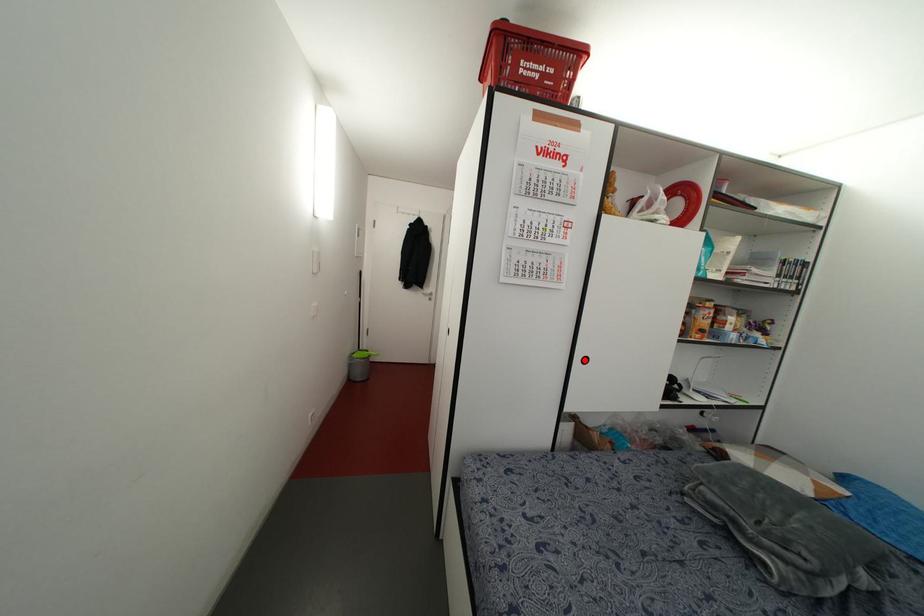
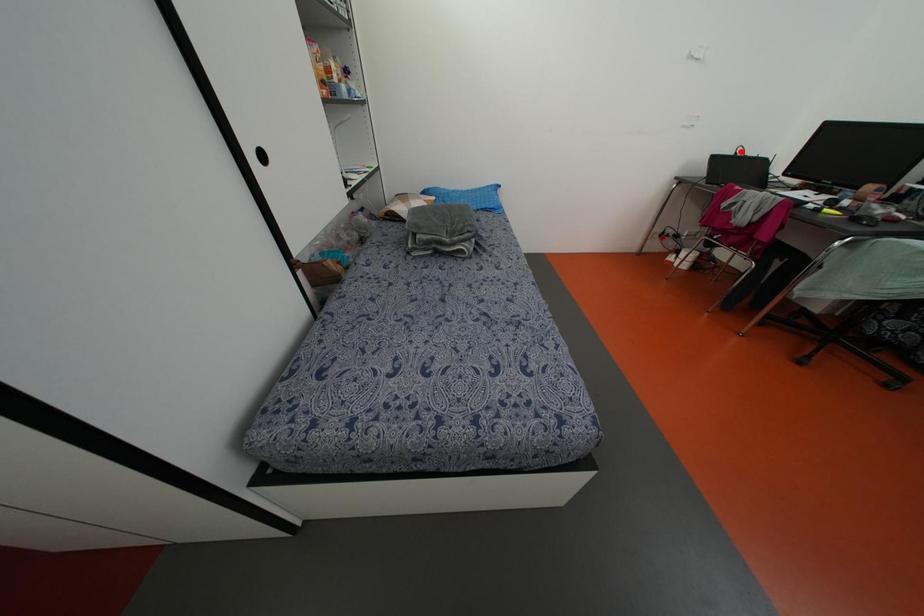
I am providing you with two images of the same scene from different viewpoints. A red point is marked on the first image and another point is marked on the second image. Is the marked point in image1 the same physical position as the marked point in image2?

No